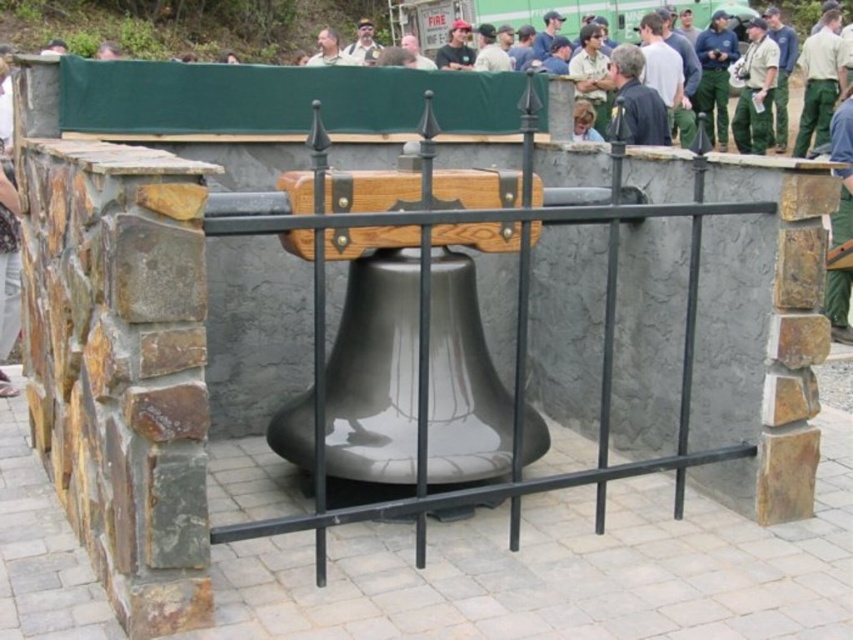
Question: Based on their relative distances, which object is farther from the green uniform at upper right?

Choices:
 (A) green uniform pants at upper right
 (B) light brown leather jacket at center

Answer: (B)

Question: Which of the following is the farthest from the observer?

Choices:
 (A) light brown leather jacket at center
 (B) green uniform pants at upper right
 (C) green uniform at upper right

Answer: (C)

Question: Estimate the real-world distances between objects in this image. Which object is closer to the green uniform at upper right?

Choices:
 (A) light brown leather jacket at center
 (B) green uniform pants at upper right

Answer: (B)

Question: Can you confirm if green uniform pants at upper right is positioned to the left of light brown leather jacket at center?

Choices:
 (A) yes
 (B) no

Answer: (B)

Question: Is green uniform pants at upper right below green uniform at upper right?

Choices:
 (A) yes
 (B) no

Answer: (A)

Question: Does green uniform pants at upper right appear over light brown leather jacket at center?

Choices:
 (A) yes
 (B) no

Answer: (A)